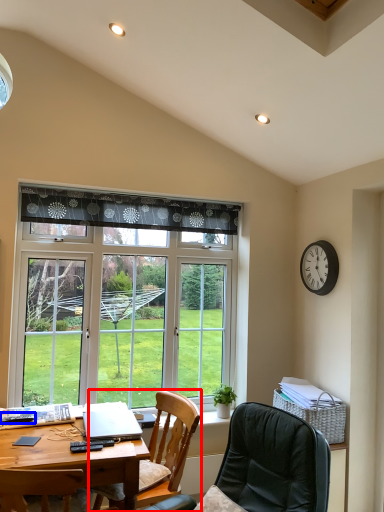
Question: Which object is further to the camera taking this photo, chair (highlighted by a red box) or remote control (highlighted by a blue box)?

Choices:
 (A) chair
 (B) remote control

Answer: (B)